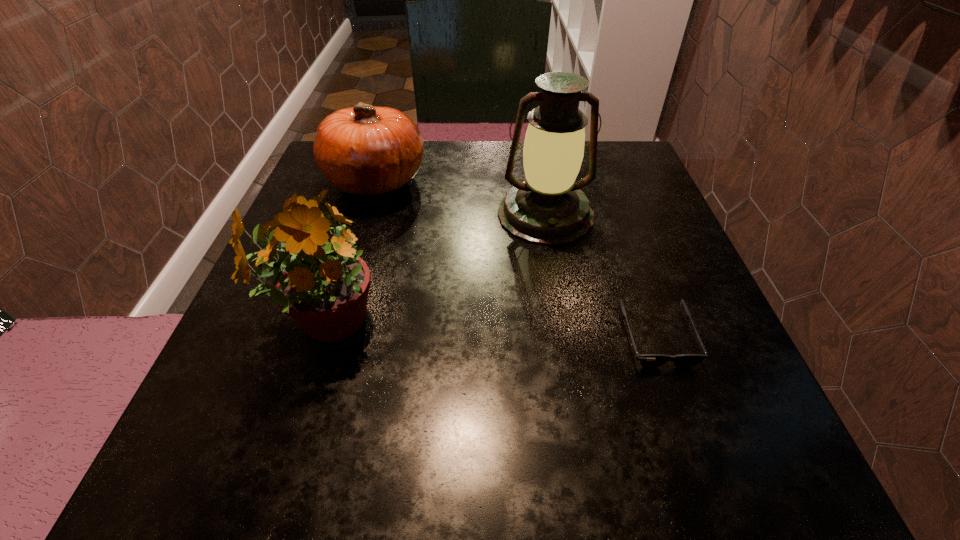
Identify the location of lantern. (548, 208).

What are the coordinates of `flowerpot` in the screenshot? It's located at (320, 281).

Where is `pumpkin`? This screenshot has height=540, width=960. pumpkin is located at coordinates (365, 150).

This screenshot has width=960, height=540. I want to click on sunglasses, so click(646, 360).

In order to click on vacant space situated with the light compartment facing forward on the lantern in this screenshot , I will do `click(571, 363)`.

Identify the location of free space located 0.150m on the right of the flowerpot. The image size is (960, 540). (476, 322).

Identify the location of free space located 0.350m on the front of the third tallest object. (324, 354).

Identify the location of vacant area situated on the temples of the shortest object. This screenshot has width=960, height=540. (696, 453).

Identify the location of lantern positioned at the far edge. The width and height of the screenshot is (960, 540). (548, 208).

Identify the location of pumpkin at the far edge. (365, 150).